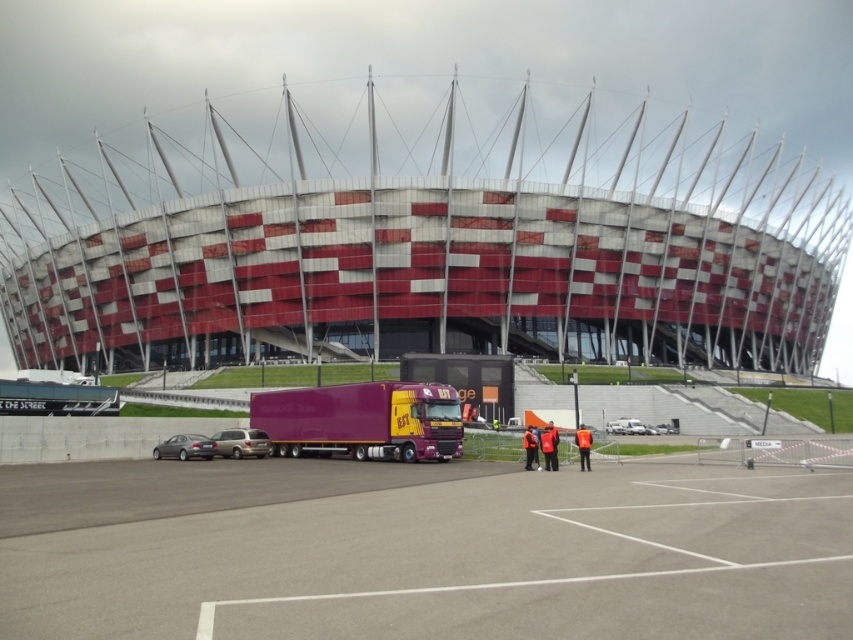
Is silver metallic sedan at lower left to the left of white matte van at lower right from the viewer's perspective?

Yes, silver metallic sedan at lower left is to the left of white matte van at lower right.

Does silver metallic sedan at lower left have a larger size compared to white matte van at lower right?

Yes, silver metallic sedan at lower left is bigger than white matte van at lower right.

Does point (171, 440) come farther from viewer compared to point (621, 422)?

No.

This screenshot has width=853, height=640. Find the location of `silver metallic sedan at lower left`. silver metallic sedan at lower left is located at coordinates (184, 448).

In the scene shown: Is silver metallic car at center positioned at the back of white matte van at lower right?

No, silver metallic car at center is in front of white matte van at lower right.

At what (x,y) coordinates should I click in order to perform the action: click on silver metallic car at center. Please return your answer as a coordinate pair (x, y). Looking at the image, I should click on (241, 442).

Does purple glossy trailer truck at center lie in front of white matte van at lower right?

That is True.

Is purple glossy trailer truck at center thinner than white matte van at lower right?

No, purple glossy trailer truck at center is not thinner than white matte van at lower right.

Which is behind, point (428, 420) or point (614, 426)?

Point (614, 426)

This screenshot has height=640, width=853. What are the coordinates of `purple glossy trailer truck at center` in the screenshot? It's located at (363, 420).